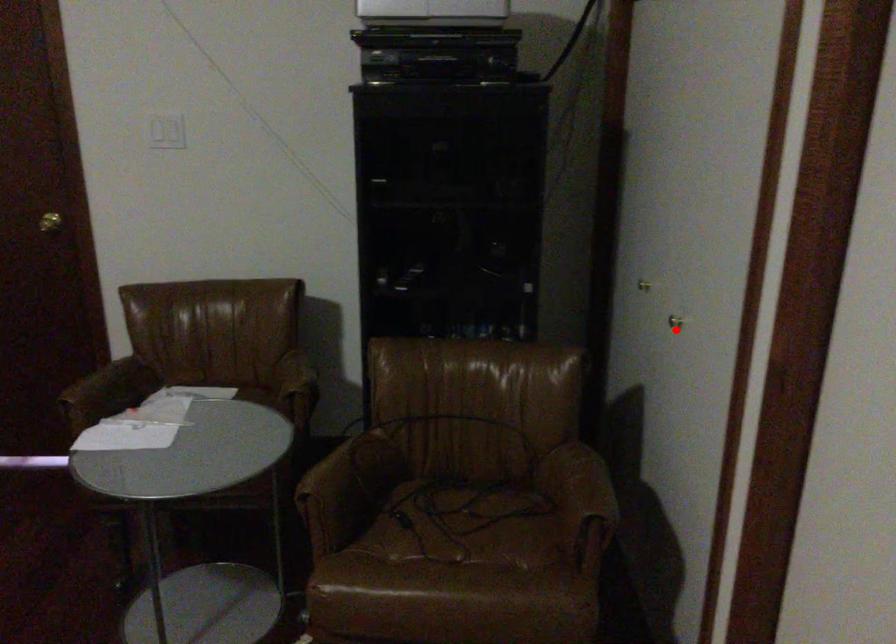
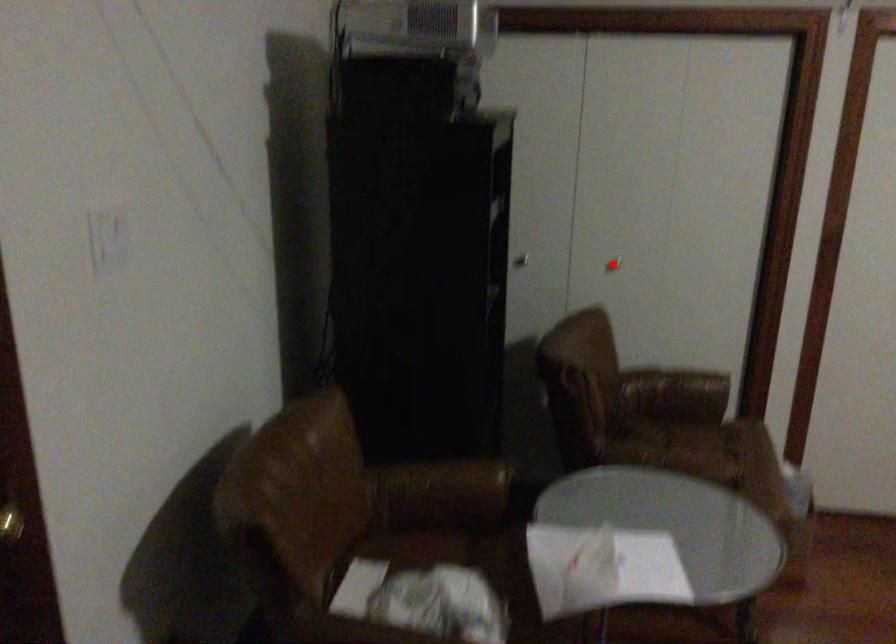
I am providing you with two images of the same scene from different viewpoints. A red point is marked on the first image and another point is marked on the second image. Is the red point in image1 aligned with the point shown in image2?

Yes